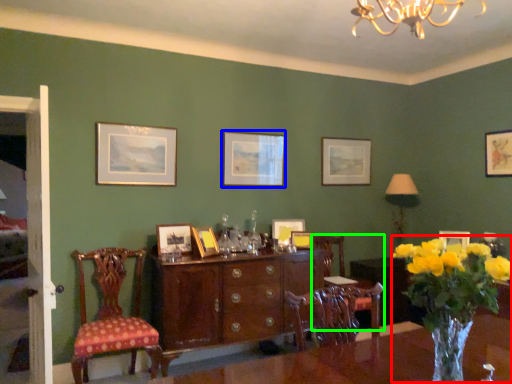
Question: Estimate the real-world distances between objects in this image. Which object is closer to floral arrangement (highlighted by a red box), picture frame (highlighted by a blue box) or chair (highlighted by a green box)?

Choices:
 (A) picture frame
 (B) chair

Answer: (B)